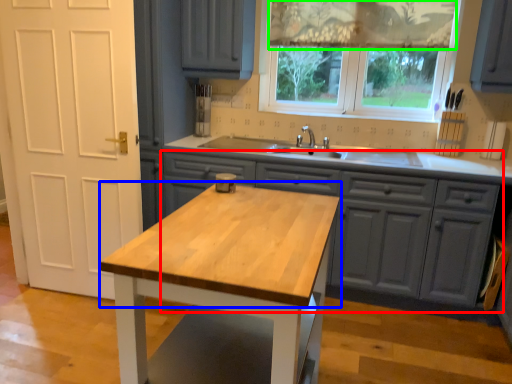
Question: Which object is the farthest from cabinetry (highlighted by a red box)? Choose among these: countertop (highlighted by a blue box) or curtain (highlighted by a green box).

Choices:
 (A) countertop
 (B) curtain

Answer: (B)